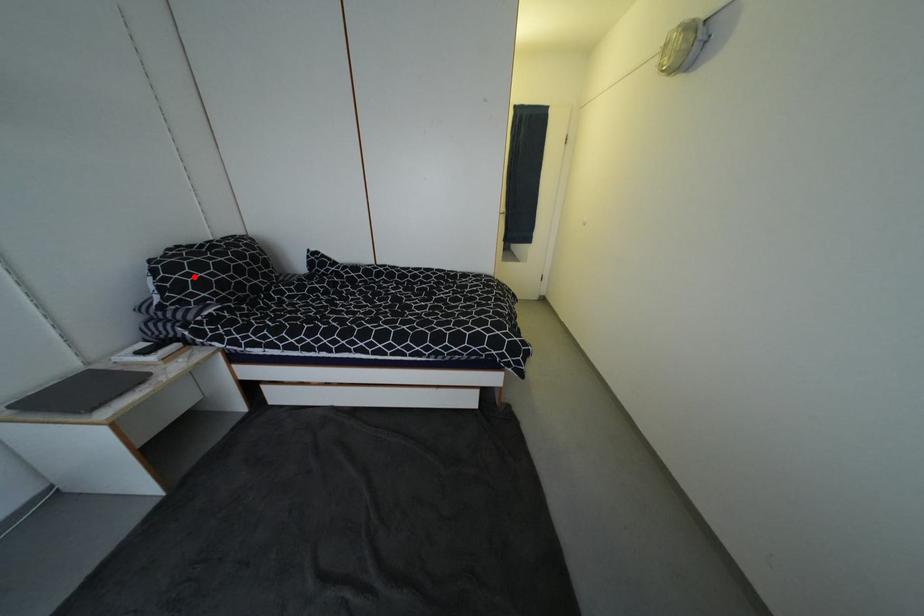
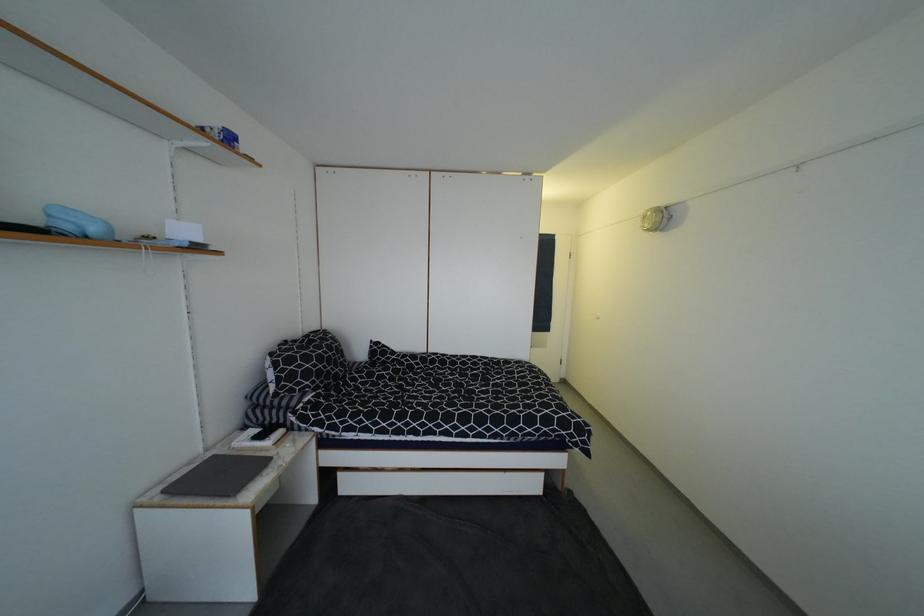
Where in the second image is the point corresponding to the highlighted location from the first image?

(305, 368)